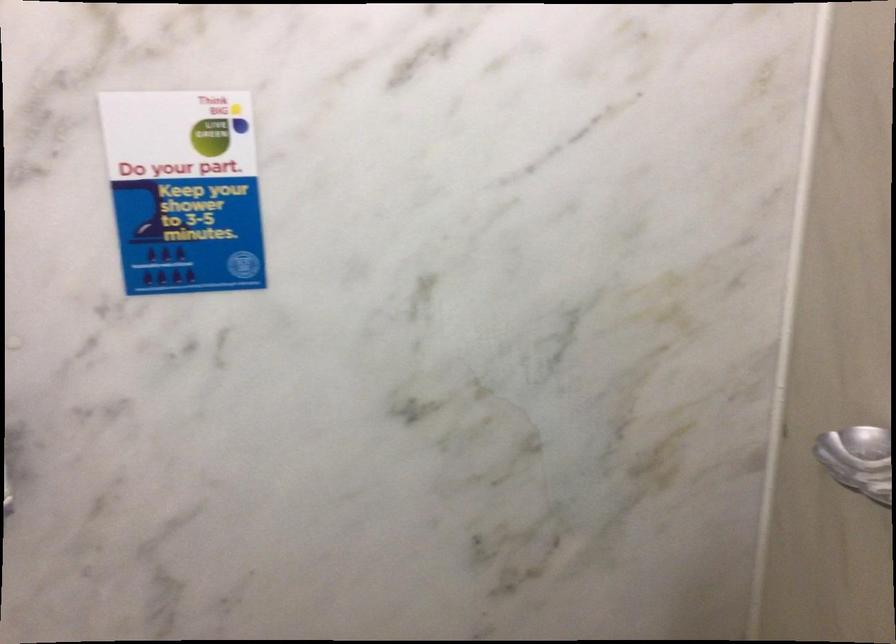
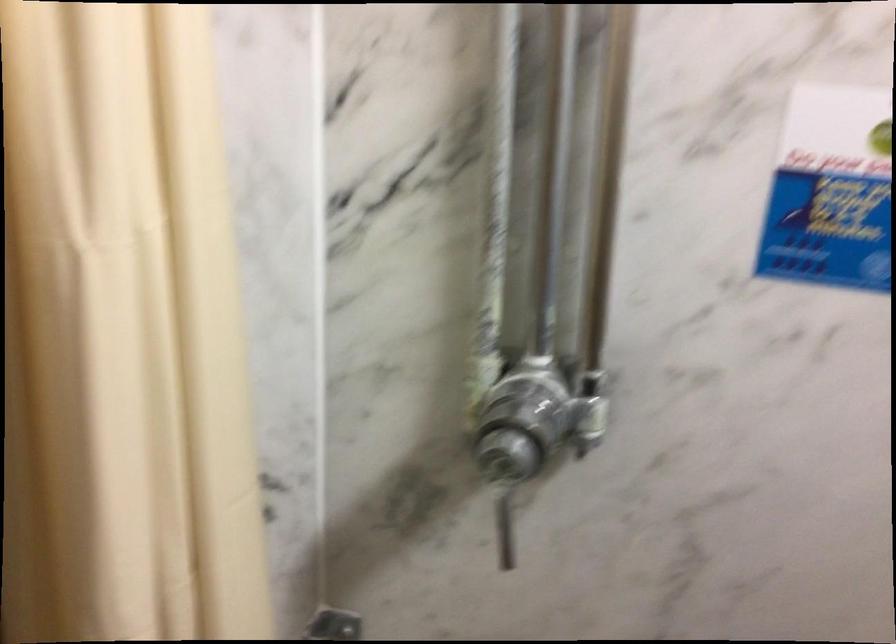
Question: What movement of the cameraman would produce the second image?

Choices:
 (A) Left
 (B) Right
 (C) Forward
 (D) Backward

Answer: (D)